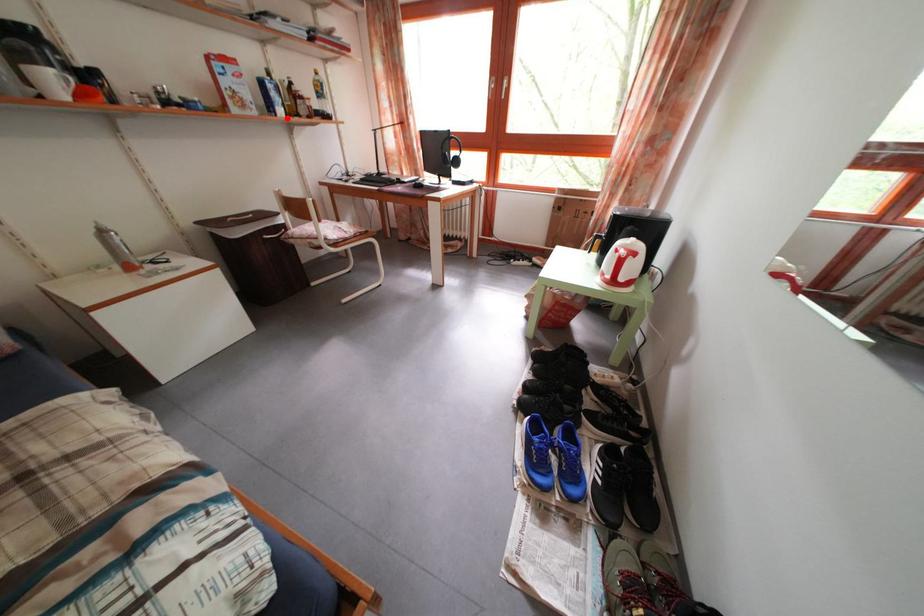
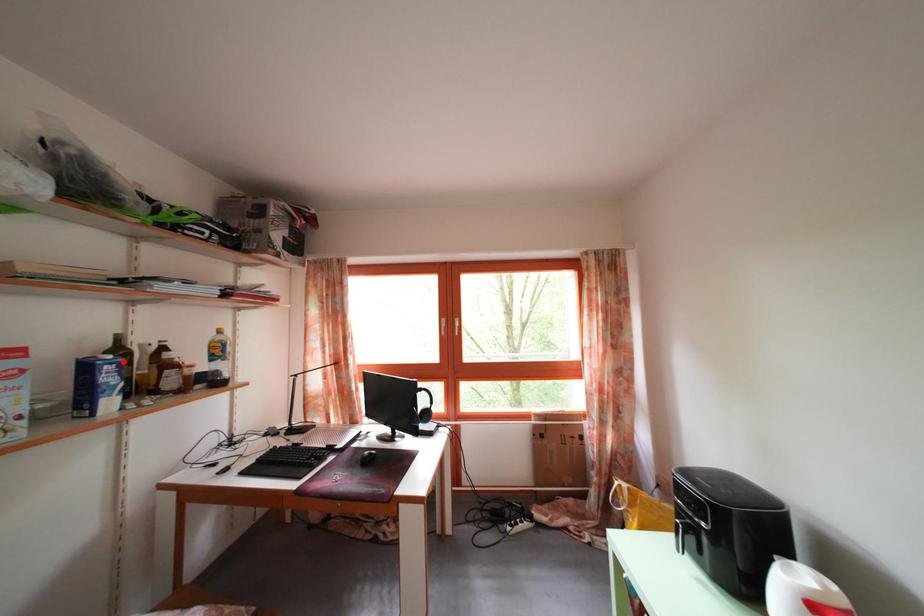
I am providing you with two images of the same scene from different viewpoints. A red point is marked on the first image and another point is marked on the second image. Is the marked point in image1 the same physical position as the marked point in image2?

No